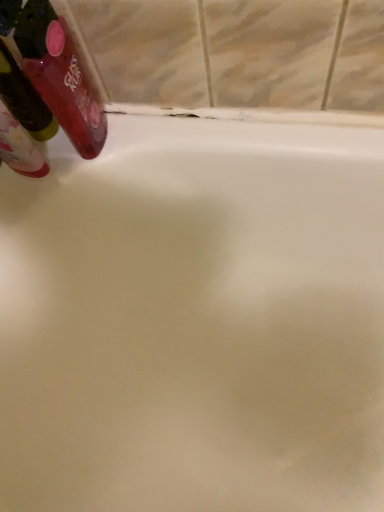
What do you see at coordinates (19, 147) in the screenshot? This screenshot has width=384, height=512. I see `translucent plastic mouthwash at upper left, the 1th mouthwash when ordered from left to right` at bounding box center [19, 147].

The image size is (384, 512). Identify the location of translucent plastic mouthwash at upper left, the 1th mouthwash when ordered from left to right. 19,147.

What is the approximate width of translucent plastic mouthwash at upper left, arranged as the first mouthwash when viewed from the right?

translucent plastic mouthwash at upper left, arranged as the first mouthwash when viewed from the right, is 2.49 inches wide.

Image resolution: width=384 pixels, height=512 pixels. Describe the element at coordinates (60, 76) in the screenshot. I see `translucent plastic mouthwash at upper left, arranged as the first mouthwash when viewed from the right` at that location.

The height and width of the screenshot is (512, 384). In order to click on translucent plastic mouthwash at upper left, arranged as the first mouthwash when viewed from the right in this screenshot , I will do `click(60, 76)`.

Find the location of a particular element. translucent plastic mouthwash at upper left, the second mouthwash viewed from the right is located at coordinates (19, 147).

Between translucent plastic mouthwash at upper left, the second mouthwash viewed from the right, and translucent plastic mouthwash at upper left, acting as the second mouthwash starting from the left, which one appears on the left side from the viewer's perspective?

Positioned to the left is translucent plastic mouthwash at upper left, the second mouthwash viewed from the right.

Is translucent plastic mouthwash at upper left, the 1th mouthwash when ordered from left to right, behind translucent plastic mouthwash at upper left, arranged as the first mouthwash when viewed from the right?

Yes, it is behind translucent plastic mouthwash at upper left, arranged as the first mouthwash when viewed from the right.

Which point is more distant from viewer, (48,167) or (81,156)?

The point (81,156) is more distant.

From the image's perspective, is translucent plastic mouthwash at upper left, the 1th mouthwash when ordered from left to right, beneath translucent plastic mouthwash at upper left, acting as the second mouthwash starting from the left?

Correct, translucent plastic mouthwash at upper left, the 1th mouthwash when ordered from left to right, appears lower than translucent plastic mouthwash at upper left, acting as the second mouthwash starting from the left, in the image.

From a real-world perspective, is translucent plastic mouthwash at upper left, the second mouthwash viewed from the right, located higher than translucent plastic mouthwash at upper left, arranged as the first mouthwash when viewed from the right?

Actually, translucent plastic mouthwash at upper left, the second mouthwash viewed from the right, is physically below translucent plastic mouthwash at upper left, arranged as the first mouthwash when viewed from the right, in the real world.

Considering the relative sizes of translucent plastic mouthwash at upper left, the 1th mouthwash when ordered from left to right, and translucent plastic mouthwash at upper left, acting as the second mouthwash starting from the left, in the image provided, is translucent plastic mouthwash at upper left, the 1th mouthwash when ordered from left to right, wider than translucent plastic mouthwash at upper left, acting as the second mouthwash starting from the left,?

In fact, translucent plastic mouthwash at upper left, the 1th mouthwash when ordered from left to right, might be narrower than translucent plastic mouthwash at upper left, acting as the second mouthwash starting from the left.

Is translucent plastic mouthwash at upper left, the 1th mouthwash when ordered from left to right, taller or shorter than translucent plastic mouthwash at upper left, arranged as the first mouthwash when viewed from the right?

translucent plastic mouthwash at upper left, the 1th mouthwash when ordered from left to right, is shorter than translucent plastic mouthwash at upper left, arranged as the first mouthwash when viewed from the right.

Who is smaller, translucent plastic mouthwash at upper left, the 1th mouthwash when ordered from left to right, or translucent plastic mouthwash at upper left, arranged as the first mouthwash when viewed from the right?

translucent plastic mouthwash at upper left, the 1th mouthwash when ordered from left to right.

In the scene shown: Could translucent plastic mouthwash at upper left, acting as the second mouthwash starting from the left, be considered to be inside translucent plastic mouthwash at upper left, the second mouthwash viewed from the right?

Actually, translucent plastic mouthwash at upper left, acting as the second mouthwash starting from the left, is outside translucent plastic mouthwash at upper left, the second mouthwash viewed from the right.

Is translucent plastic mouthwash at upper left, the second mouthwash viewed from the right, far from translucent plastic mouthwash at upper left, acting as the second mouthwash starting from the left?

No.

Does translucent plastic mouthwash at upper left, the second mouthwash viewed from the right, turn towards translucent plastic mouthwash at upper left, acting as the second mouthwash starting from the left?

No, translucent plastic mouthwash at upper left, the second mouthwash viewed from the right, is not aimed at translucent plastic mouthwash at upper left, acting as the second mouthwash starting from the left.

How different are the orientations of translucent plastic mouthwash at upper left, the 1th mouthwash when ordered from left to right, and translucent plastic mouthwash at upper left, acting as the second mouthwash starting from the left, in degrees?

translucent plastic mouthwash at upper left, the 1th mouthwash when ordered from left to right, and translucent plastic mouthwash at upper left, acting as the second mouthwash starting from the left, are facing 91.9 degrees away from each other.

Where is `mouthwash on the right of translucent plastic mouthwash at upper left, the 1th mouthwash when ordered from left to right`? mouthwash on the right of translucent plastic mouthwash at upper left, the 1th mouthwash when ordered from left to right is located at coordinates click(x=60, y=76).

Which object is positioned more to the right, translucent plastic mouthwash at upper left, acting as the second mouthwash starting from the left, or translucent plastic mouthwash at upper left, the 1th mouthwash when ordered from left to right?

From the viewer's perspective, translucent plastic mouthwash at upper left, acting as the second mouthwash starting from the left, appears more on the right side.

Which object is closer to the camera taking this photo, translucent plastic mouthwash at upper left, arranged as the first mouthwash when viewed from the right, or translucent plastic mouthwash at upper left, the 1th mouthwash when ordered from left to right?

translucent plastic mouthwash at upper left, arranged as the first mouthwash when viewed from the right.

Which is behind, point (73, 103) or point (7, 120)?

The point (73, 103) is farther from the camera.

From the image's perspective, does translucent plastic mouthwash at upper left, arranged as the first mouthwash when viewed from the right, appear higher than translucent plastic mouthwash at upper left, the 1th mouthwash when ordered from left to right?

Yes.

From a real-world perspective, is translucent plastic mouthwash at upper left, acting as the second mouthwash starting from the left, positioned above or below translucent plastic mouthwash at upper left, the second mouthwash viewed from the right?

In terms of real-world spatial position, translucent plastic mouthwash at upper left, acting as the second mouthwash starting from the left, is above translucent plastic mouthwash at upper left, the second mouthwash viewed from the right.

In terms of width, does translucent plastic mouthwash at upper left, arranged as the first mouthwash when viewed from the right, look wider or thinner when compared to translucent plastic mouthwash at upper left, the 1th mouthwash when ordered from left to right?

translucent plastic mouthwash at upper left, arranged as the first mouthwash when viewed from the right, is wider than translucent plastic mouthwash at upper left, the 1th mouthwash when ordered from left to right.

Does translucent plastic mouthwash at upper left, acting as the second mouthwash starting from the left, have a lesser height compared to translucent plastic mouthwash at upper left, the 1th mouthwash when ordered from left to right?

No.

Is translucent plastic mouthwash at upper left, acting as the second mouthwash starting from the left, smaller than translucent plastic mouthwash at upper left, the second mouthwash viewed from the right?

Actually, translucent plastic mouthwash at upper left, acting as the second mouthwash starting from the left, might be larger than translucent plastic mouthwash at upper left, the second mouthwash viewed from the right.

Is translucent plastic mouthwash at upper left, arranged as the first mouthwash when viewed from the right, completely or partially outside of translucent plastic mouthwash at upper left, the 1th mouthwash when ordered from left to right?

Indeed, translucent plastic mouthwash at upper left, arranged as the first mouthwash when viewed from the right, is completely outside translucent plastic mouthwash at upper left, the 1th mouthwash when ordered from left to right.

Is translucent plastic mouthwash at upper left, acting as the second mouthwash starting from the left, far away from translucent plastic mouthwash at upper left, the second mouthwash viewed from the right?

No, translucent plastic mouthwash at upper left, acting as the second mouthwash starting from the left, is in close proximity to translucent plastic mouthwash at upper left, the second mouthwash viewed from the right.

Does translucent plastic mouthwash at upper left, acting as the second mouthwash starting from the left, turn towards translucent plastic mouthwash at upper left, the 1th mouthwash when ordered from left to right?

No, translucent plastic mouthwash at upper left, acting as the second mouthwash starting from the left, is not aimed at translucent plastic mouthwash at upper left, the 1th mouthwash when ordered from left to right.

Find the location of a particular element. This screenshot has height=512, width=384. mouthwash on the right side of translucent plastic mouthwash at upper left, the second mouthwash viewed from the right is located at coordinates (60, 76).

Where is `mouthwash on the right of the translucent plastic mouthwash at upper left, the 1th mouthwash when ordered from left to right`? The width and height of the screenshot is (384, 512). mouthwash on the right of the translucent plastic mouthwash at upper left, the 1th mouthwash when ordered from left to right is located at coordinates (60, 76).

The width and height of the screenshot is (384, 512). Find the location of `mouthwash positioned vertically above the translucent plastic mouthwash at upper left, the second mouthwash viewed from the right (from a real-world perspective)`. mouthwash positioned vertically above the translucent plastic mouthwash at upper left, the second mouthwash viewed from the right (from a real-world perspective) is located at coordinates (60, 76).